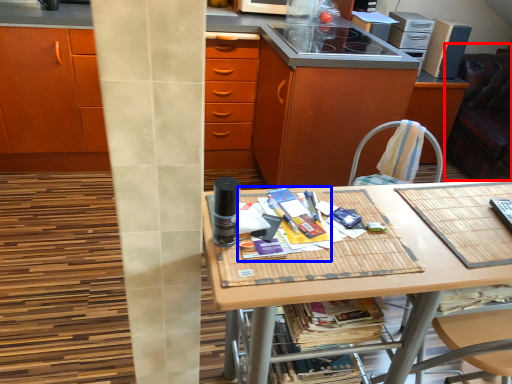
Question: Which object is closer to the camera taking this photo, swivel chair (highlighted by a red box) or magazine (highlighted by a blue box)?

Choices:
 (A) swivel chair
 (B) magazine

Answer: (B)